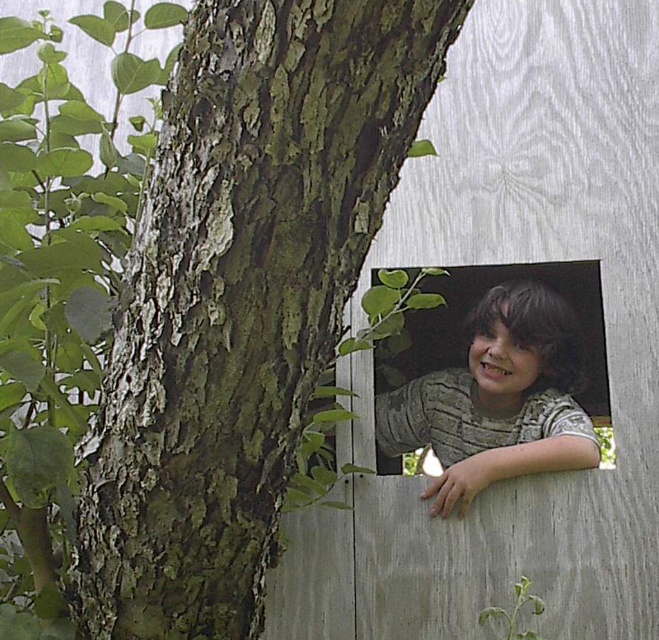
Question: Does greenish-brown bark at center lie behind matte gray shirt at center?

Choices:
 (A) no
 (B) yes

Answer: (A)

Question: Is greenish-brown bark at center bigger than matte gray shirt at center?

Choices:
 (A) no
 (B) yes

Answer: (B)

Question: Which point is farther from the camera taking this photo?

Choices:
 (A) (558, 316)
 (B) (252, 144)

Answer: (A)

Question: Does greenish-brown bark at center appear on the left side of matte gray shirt at center?

Choices:
 (A) no
 (B) yes

Answer: (B)